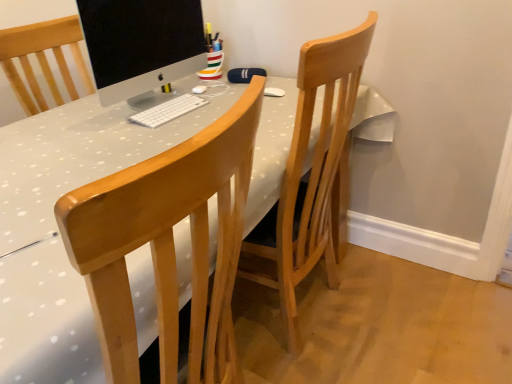
The image size is (512, 384). Find the location of `vacant space in front of sleek silver monitor at center`. vacant space in front of sleek silver monitor at center is located at coordinates (160, 129).